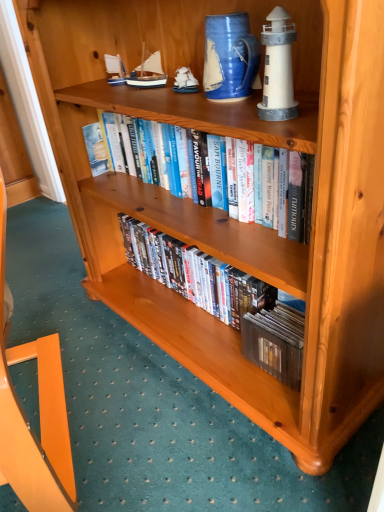
Question: Should I look upward or downward to see hardcover books at center, placed as the first book when sorted from top to bottom?

Choices:
 (A) down
 (B) up

Answer: (B)

Question: Is blue painted wood sailboat at upper center, which ranks as the first toy in left-to-right order, located outside blue ceramic pitcher at upper center?

Choices:
 (A) yes
 (B) no

Answer: (A)

Question: Are blue painted wood sailboat at upper center, which ranks as the third toy in right-to-left order, and blue ceramic pitcher at upper center located far from each other?

Choices:
 (A) no
 (B) yes

Answer: (A)

Question: Considering the relative positions of blue painted wood sailboat at upper center, acting as the 3th toy starting from the front, and blue ceramic pitcher at upper center in the image provided, is blue painted wood sailboat at upper center, acting as the 3th toy starting from the front, behind blue ceramic pitcher at upper center?

Choices:
 (A) yes
 (B) no

Answer: (A)

Question: Considering the relative sizes of blue painted wood sailboat at upper center, placed as the first toy when sorted from back to front, and blue ceramic pitcher at upper center in the image provided, is blue painted wood sailboat at upper center, placed as the first toy when sorted from back to front, smaller than blue ceramic pitcher at upper center?

Choices:
 (A) yes
 (B) no

Answer: (A)

Question: Considering the relative sizes of blue painted wood sailboat at upper center, placed as the first toy when sorted from back to front, and blue ceramic pitcher at upper center in the image provided, is blue painted wood sailboat at upper center, placed as the first toy when sorted from back to front, bigger than blue ceramic pitcher at upper center?

Choices:
 (A) yes
 (B) no

Answer: (B)

Question: From the image's perspective, is blue painted wood sailboat at upper center, which ranks as the third toy in right-to-left order, located beneath blue ceramic pitcher at upper center?

Choices:
 (A) no
 (B) yes

Answer: (A)

Question: Is blue ceramic pitcher at upper center thinner than white matte lighthouse at upper right, the 1th toy in the right-to-left sequence?

Choices:
 (A) no
 (B) yes

Answer: (A)

Question: Is blue ceramic pitcher at upper center taller than white matte lighthouse at upper right, placed as the 3th toy when sorted from back to front?

Choices:
 (A) yes
 (B) no

Answer: (B)

Question: Does blue ceramic pitcher at upper center lie in front of white matte lighthouse at upper right, placed as the 3th toy when sorted from back to front?

Choices:
 (A) no
 (B) yes

Answer: (A)

Question: Is blue ceramic pitcher at upper center in contact with white matte lighthouse at upper right, the 1th toy in the right-to-left sequence?

Choices:
 (A) yes
 (B) no

Answer: (B)

Question: From the image's perspective, is blue ceramic pitcher at upper center located above white matte lighthouse at upper right, which is counted as the first toy, starting from the front?

Choices:
 (A) no
 (B) yes

Answer: (B)

Question: Is blue ceramic pitcher at upper center oriented towards white matte lighthouse at upper right, acting as the third toy starting from the left?

Choices:
 (A) yes
 (B) no

Answer: (B)

Question: Is blue painted wood sailboat at upper center, acting as the 3th toy starting from the front, smaller than matte wooden dvds at center, which appears as the 2th book when viewed from the top?

Choices:
 (A) yes
 (B) no

Answer: (A)